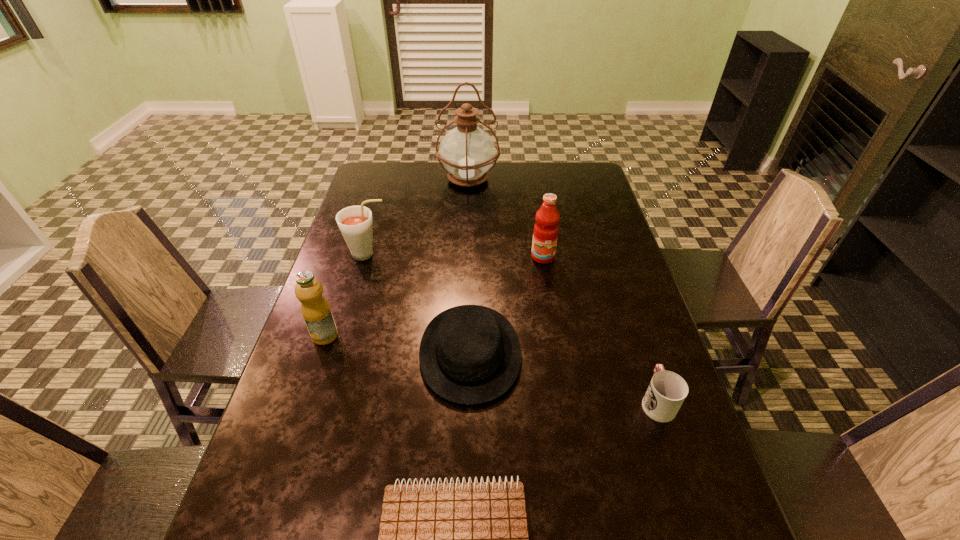
The height and width of the screenshot is (540, 960). I want to click on the farthest object, so click(x=467, y=152).

You are a GUI agent. You are given a task and a screenshot of the screen. Output one action in this format:
    pyautogui.click(x=<x>, y=<y>)
    Task: Click on the tallest object
    
    Given the screenshot: What is the action you would take?
    pyautogui.click(x=467, y=152)

Where is `the sixth object from left to right`? This screenshot has width=960, height=540. the sixth object from left to right is located at coordinates (545, 234).

At what (x,y) coordinates should I click in order to perform the action: click on the right fruit juice. Please return your answer as a coordinate pair (x, y). Image resolution: width=960 pixels, height=540 pixels. Looking at the image, I should click on (545, 234).

You are a GUI agent. You are given a task and a screenshot of the screen. Output one action in this format:
    pyautogui.click(x=<x>, y=<y>)
    Task: Click on the left fruit juice
    
    Given the screenshot: What is the action you would take?
    pyautogui.click(x=316, y=311)

Where is `root beer`? This screenshot has height=540, width=960. root beer is located at coordinates [355, 222].

You are a GUI agent. You are given a task and a screenshot of the screen. Output one action in this format:
    pyautogui.click(x=<x>, y=<y>)
    Task: Click on the fedora
    Image resolution: width=960 pixels, height=540 pixels.
    Given the screenshot: What is the action you would take?
    pyautogui.click(x=470, y=354)

I want to click on cup, so click(667, 391).

Find the location of a particular element. The image size is (960, 540). vacant position located 0.260m on the front of the oil lamp is located at coordinates (466, 240).

The width and height of the screenshot is (960, 540). Find the location of `free space located 0.320m on the front label of the sixth object from left to right`. free space located 0.320m on the front label of the sixth object from left to right is located at coordinates (558, 349).